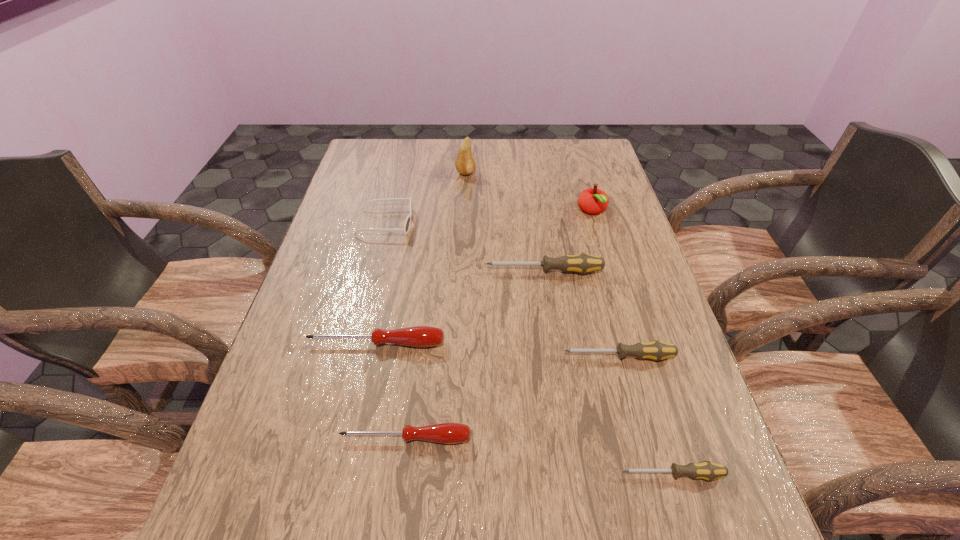
Identify the location of vacant area between the farthest screwdriver and the shortest screwdriver. The width and height of the screenshot is (960, 540). (609, 373).

Select which object appears as the sixth closest to the sunglasses. Please provide its 2D coordinates. Your answer should be formatted as a tuple, i.e. [(x, y)], where the tuple contains the x and y coordinates of a point satisfying the conditions above.

[(446, 433)]

I want to click on object that can be found as the fourth closest to the second nearest screwdriver, so (582, 263).

Locate which screwdriver is the closest to the tallest object. Please provide its 2D coordinates. Your answer should be formatted as a tuple, i.e. [(x, y)], where the tuple contains the x and y coordinates of a point satisfying the conditions above.

[(582, 263)]

You are a GUI agent. You are given a task and a screenshot of the screen. Output one action in this format:
    pyautogui.click(x=<x>, y=<y>)
    Task: Click on the third closest screwdriver to the fourth farthest object
    
    Given the screenshot: What is the action you would take?
    pyautogui.click(x=446, y=433)

Locate which gray screwdriver ranks second in proximity to the farthest object. Please provide its 2D coordinates. Your answer should be formatted as a tuple, i.e. [(x, y)], where the tuple contains the x and y coordinates of a point satisfying the conditions above.

[(655, 350)]

Find the location of a particular element. gray screwdriver that stands as the second closest to the smallest gray screwdriver is located at coordinates (582, 263).

Locate which red screwdriver is the second closest to the second nearest gray screwdriver. Please provide its 2D coordinates. Your answer should be formatted as a tuple, i.e. [(x, y)], where the tuple contains the x and y coordinates of a point satisfying the conditions above.

[(418, 336)]

Where is `red screwdriver that stands as the second closest to the second tallest object`? This screenshot has width=960, height=540. red screwdriver that stands as the second closest to the second tallest object is located at coordinates (446, 433).